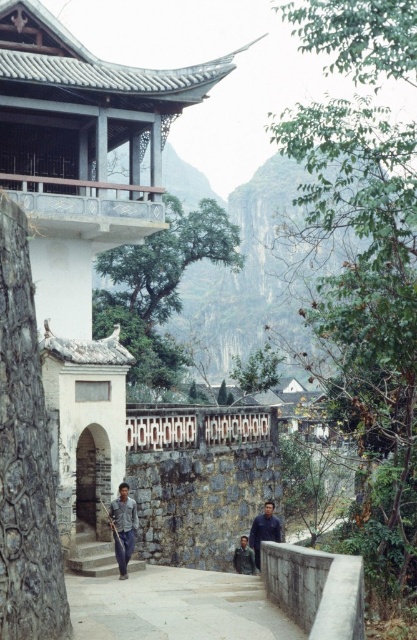
Question: Among these points, which one is farthest from the camera?

Choices:
 (A) (105, 548)
 (B) (117, 513)

Answer: (A)

Question: Is the position of gray stone man at lower center less distant than that of dark gray fabric jacket at center?

Choices:
 (A) no
 (B) yes

Answer: (B)

Question: Which object is farther from the camera taking this photo?

Choices:
 (A) stone stairs at lower left
 (B) gray stone man at lower center
 (C) white stone temple at left

Answer: (A)

Question: Does gray stone man at lower center appear on the right side of dark blue shirt at center?

Choices:
 (A) no
 (B) yes

Answer: (A)

Question: Considering the relative positions of gray stone man at lower center and dark gray fabric jacket at center in the image provided, where is gray stone man at lower center located with respect to dark gray fabric jacket at center?

Choices:
 (A) right
 (B) left

Answer: (B)

Question: Which is farther from the dark gray fabric jacket at center?

Choices:
 (A) white stone temple at left
 (B) gray stone man at lower center
 (C) gray stone steps at center

Answer: (A)